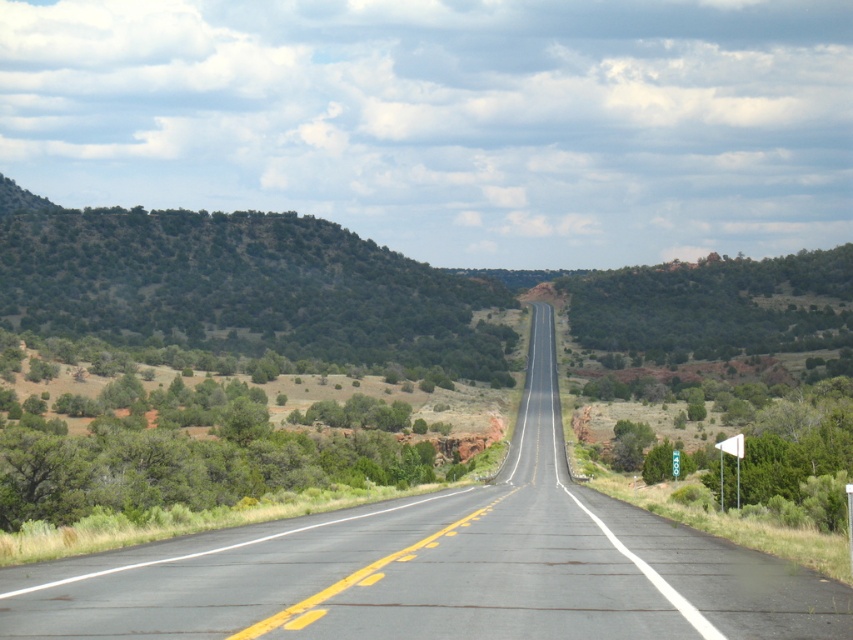
You are standing at the starting point of the road and want to reach a destination marked by two points on the road. The first point is at coordinates point (454, 497) and the second is at point (291, 337). Which point should you head towards first if you want to reach the nearest destination first?

You should head towards point (454, 497) first because it is closer to the camera, meaning it is nearer to your current position compared to point (291, 337).

You are a driver approaching the asphalt road at center and notice the green shrubbery at left. Which object is taller when viewed from your perspective?

The green shrubbery at left is taller than the asphalt road at center.

You are a driver approaching the asphalt road at center and the green shrubbery at left. Which of these two objects appears smaller in the image?

The asphalt road at center appears smaller in the image compared to the green shrubbery at left.